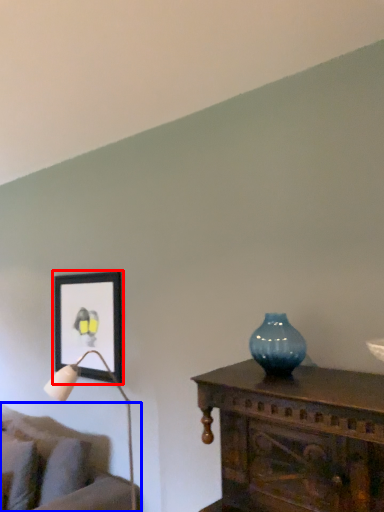
Question: Which point is closer to the camera, picture frame (highlighted by a red box) or studio couch (highlighted by a blue box)?

Choices:
 (A) picture frame
 (B) studio couch

Answer: (B)